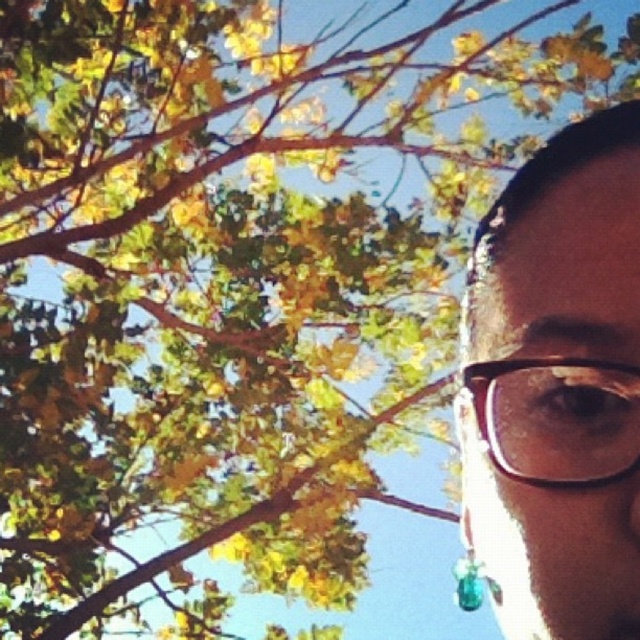
Question: Is translucent plastic glasses at right smaller than translucent teal pendant at lower right?

Choices:
 (A) no
 (B) yes

Answer: (B)

Question: Is brown matte glasses at right positioned before translucent teal pendant at lower right?

Choices:
 (A) yes
 (B) no

Answer: (A)

Question: Among these objects, which one is nearest to the camera?

Choices:
 (A) brown matte glasses at right
 (B) translucent teal pendant at lower right
 (C) translucent plastic glasses at right

Answer: (A)

Question: Among these objects, which one is nearest to the camera?

Choices:
 (A) translucent plastic glasses at right
 (B) brown matte glasses at right

Answer: (B)

Question: Does brown matte glasses at right come in front of translucent teal pendant at lower right?

Choices:
 (A) no
 (B) yes

Answer: (B)

Question: Which of the following is the farthest from the observer?

Choices:
 (A) brown matte glasses at right
 (B) translucent plastic glasses at right

Answer: (B)